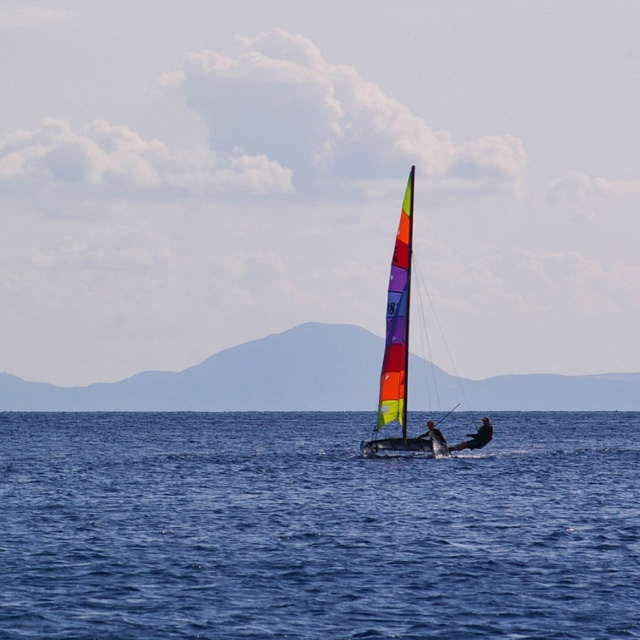
Which is more to the right, blue water at center or rainbow sail sailboat at center?

From the viewer's perspective, rainbow sail sailboat at center appears more on the right side.

Is point (380, 618) closer to viewer compared to point (412, 177)?

Yes, it is.

Where is `blue water at center`? The image size is (640, 640). blue water at center is located at coordinates (314, 529).

This screenshot has height=640, width=640. Find the location of `blue water at center`. blue water at center is located at coordinates (314, 529).

Between point (20, 618) and point (54, 406), which one is positioned in front?

Point (20, 618) is in front.

Locate an element on the screen. blue water at center is located at coordinates (314, 529).

I want to click on blue water at center, so click(x=314, y=529).

Who is shorter, blue water at center or smooth black sailboat at center?

smooth black sailboat at center

Is point (93, 492) positioned in front of point (486, 428)?

Yes, it is.

Where is `blue water at center`? blue water at center is located at coordinates click(x=314, y=529).